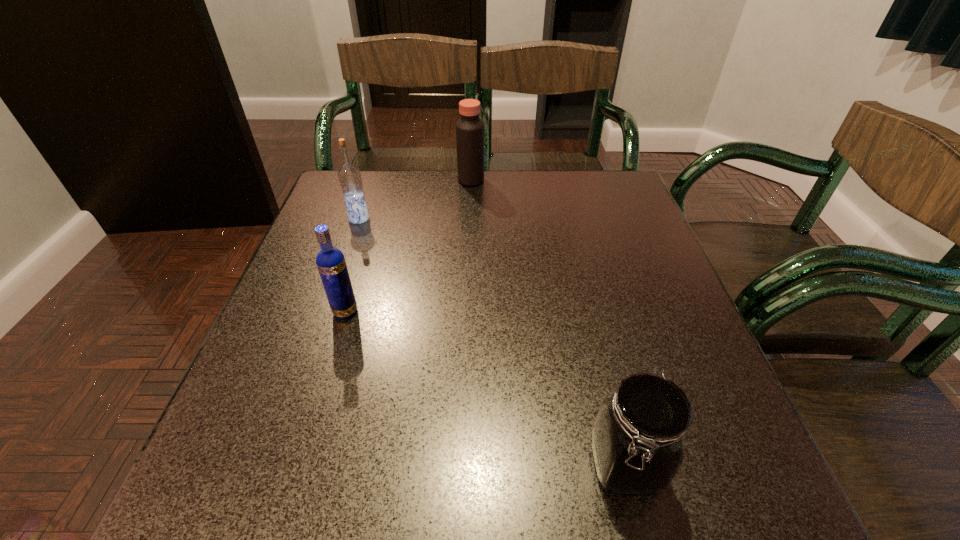
At what (x,y) coordinates should I click in order to perform the action: click on the farthest object. Please return your answer as a coordinate pair (x, y). Looking at the image, I should click on (469, 128).

The height and width of the screenshot is (540, 960). I want to click on the second object from right to left, so click(x=469, y=128).

Where is `the second farthest object`? The height and width of the screenshot is (540, 960). the second farthest object is located at coordinates click(349, 176).

Image resolution: width=960 pixels, height=540 pixels. In order to click on the third farthest object in this screenshot , I will do `click(331, 264)`.

Where is `the rightmost object`? This screenshot has width=960, height=540. the rightmost object is located at coordinates (637, 438).

Identify the location of jar. (637, 438).

Identify the location of free space located on the right of the farthest object. This screenshot has width=960, height=540. coord(527,180).

What are the coordinates of `free region located on the right of the second farthest object` in the screenshot? It's located at (494, 219).

Locate an element on the screen. free point located on the front of the second nearest object is located at coordinates (289, 500).

This screenshot has height=540, width=960. Find the location of `vinegar positioned at the far edge`. vinegar positioned at the far edge is located at coordinates (469, 128).